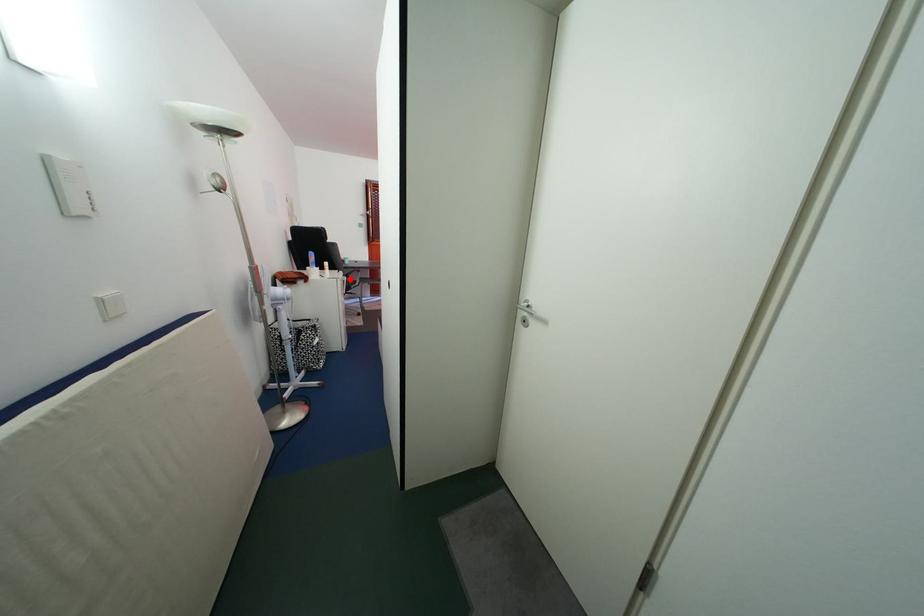
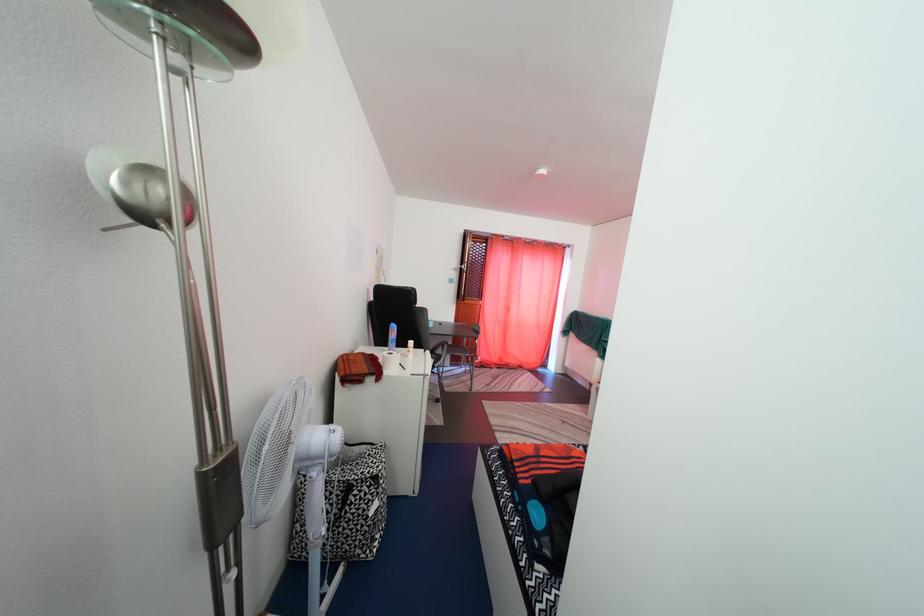
Question: I am providing you with two images of the same scene from different viewpoints. Given a red point in image1, look at the same physical point in image2. Is it:

Choices:
 (A) Closer to the viewpoint
 (B) Farther from the viewpoint

Answer: (B)